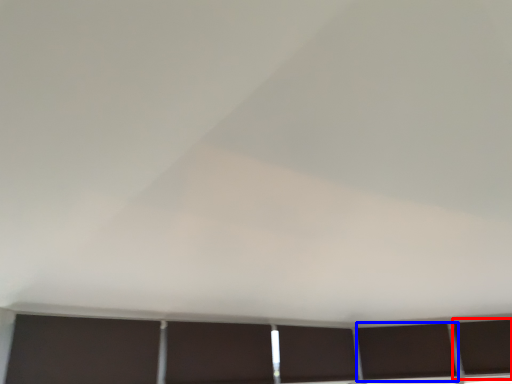
Question: Which object is further to the camera taking this photo, window (highlighted by a red box) or window (highlighted by a blue box)?

Choices:
 (A) window
 (B) window

Answer: (B)